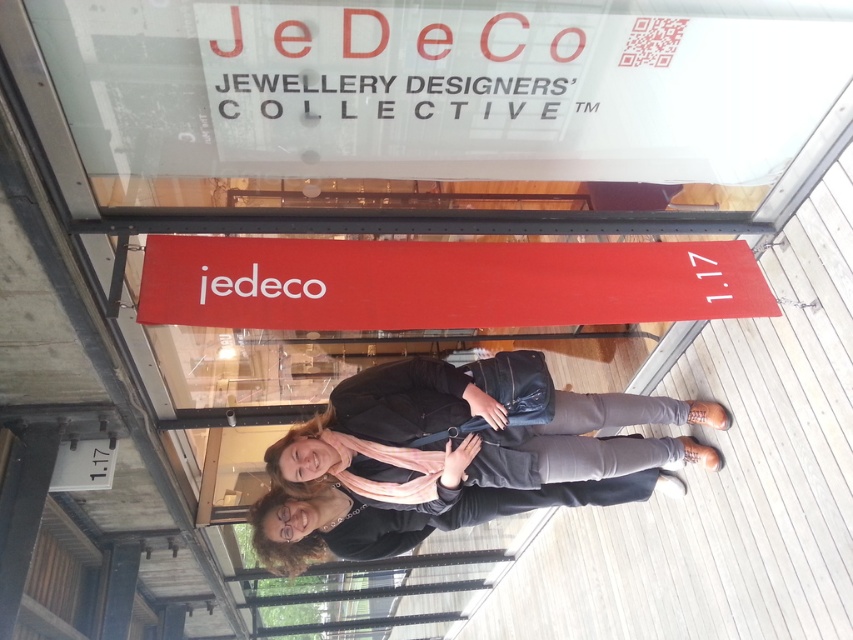
Between red matte sign at center and matte black jacket at center, which one has less height?

Standing shorter between the two is red matte sign at center.

Who is lower down, red matte sign at center or matte black jacket at center?

matte black jacket at center is lower down.

Which is in front, point (169, 268) or point (515, 401)?

Positioned in front is point (169, 268).

Identify the location of red matte sign at center. (442, 282).